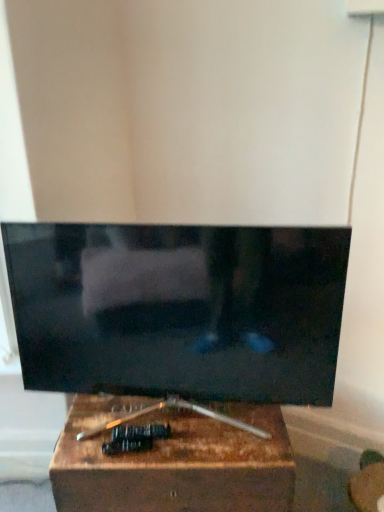
Question: Is matte black tv at center to the left or to the right of wooden box at center in the image?

Choices:
 (A) left
 (B) right

Answer: (A)

Question: Is matte black tv at center wider or thinner than wooden box at center?

Choices:
 (A) wide
 (B) thin

Answer: (B)

Question: In the image, is matte black tv at center positioned in front of or behind wooden box at center?

Choices:
 (A) behind
 (B) front

Answer: (B)

Question: Which is correct: wooden box at center is inside matte black tv at center, or outside of it?

Choices:
 (A) inside
 (B) outside

Answer: (B)

Question: Is wooden box at center to the left or to the right of matte black tv at center in the image?

Choices:
 (A) right
 (B) left

Answer: (A)

Question: From a real-world perspective, is wooden box at center above or below matte black tv at center?

Choices:
 (A) above
 (B) below

Answer: (B)

Question: Is wooden box at center in front of or behind matte black tv at center in the image?

Choices:
 (A) behind
 (B) front

Answer: (A)